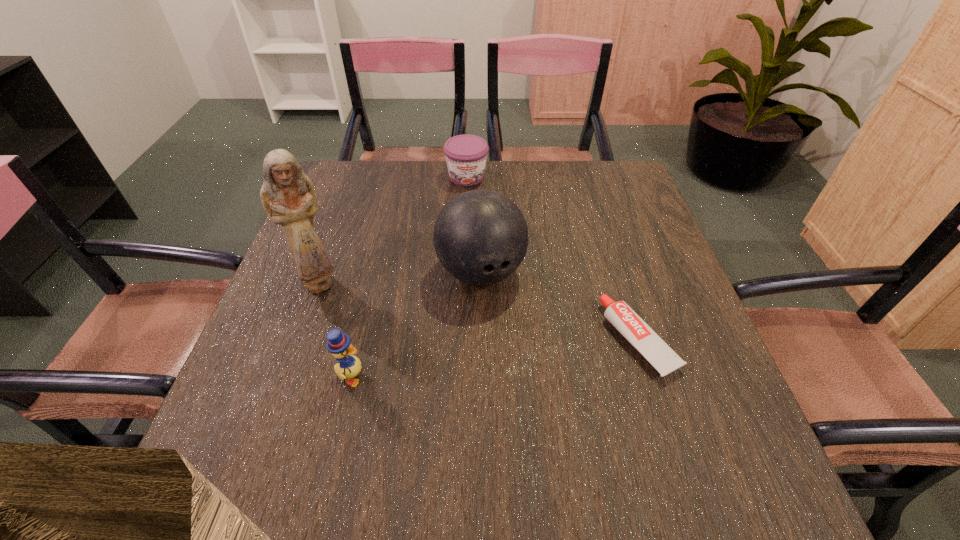
Locate an element on the screen. The height and width of the screenshot is (540, 960). vacant spot on the desktop that is between the second object from left to right and the rightmost object and is positioned on the grip area of the bowling ball is located at coordinates (522, 355).

The width and height of the screenshot is (960, 540). Find the location of `vacant space on the desktop that is between the duckling and the toothpaste and is positioned on the front label of the jam`. vacant space on the desktop that is between the duckling and the toothpaste and is positioned on the front label of the jam is located at coordinates (506, 357).

Where is `vacant space on the desktop that is between the third shortest object and the shortest object and is positioned on the front-facing side of the figurine`? Image resolution: width=960 pixels, height=540 pixels. vacant space on the desktop that is between the third shortest object and the shortest object and is positioned on the front-facing side of the figurine is located at coordinates (501, 358).